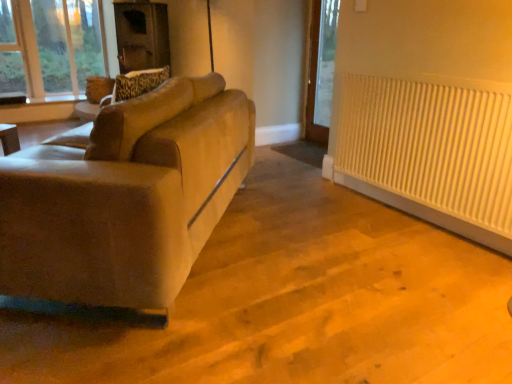
Question: Considering the relative sizes of white ribbed radiator at right and beige fabric swivel chair at left in the image provided, is white ribbed radiator at right smaller than beige fabric swivel chair at left?

Choices:
 (A) no
 (B) yes

Answer: (A)

Question: Does white ribbed radiator at right have a greater height compared to beige fabric swivel chair at left?

Choices:
 (A) yes
 (B) no

Answer: (A)

Question: Is the surface of white ribbed radiator at right in direct contact with beige fabric swivel chair at left?

Choices:
 (A) yes
 (B) no

Answer: (B)

Question: From a real-world perspective, is white ribbed radiator at right over beige fabric swivel chair at left?

Choices:
 (A) no
 (B) yes

Answer: (A)

Question: Is white ribbed radiator at right to the right of beige fabric swivel chair at left from the viewer's perspective?

Choices:
 (A) yes
 (B) no

Answer: (A)

Question: Is beige fabric swivel chair at left in front of or behind white ribbed radiator at right in the image?

Choices:
 (A) behind
 (B) front

Answer: (B)

Question: Considering the positions of beige fabric swivel chair at left and white ribbed radiator at right in the image, is beige fabric swivel chair at left wider or thinner than white ribbed radiator at right?

Choices:
 (A) wide
 (B) thin

Answer: (A)

Question: Do you think beige fabric swivel chair at left is within white ribbed radiator at right, or outside of it?

Choices:
 (A) inside
 (B) outside

Answer: (B)

Question: From the image's perspective, relative to white ribbed radiator at right, is beige fabric swivel chair at left above or below?

Choices:
 (A) below
 (B) above

Answer: (B)

Question: Would you say suede-like beige couch at left is to the left or to the right of beige fabric swivel chair at left in the picture?

Choices:
 (A) right
 (B) left

Answer: (B)

Question: Looking at their shapes, would you say suede-like beige couch at left is wider or thinner than beige fabric swivel chair at left?

Choices:
 (A) thin
 (B) wide

Answer: (B)

Question: In terms of size, does suede-like beige couch at left appear bigger or smaller than beige fabric swivel chair at left?

Choices:
 (A) big
 (B) small

Answer: (A)

Question: Is suede-like beige couch at left in front of or behind beige fabric swivel chair at left in the image?

Choices:
 (A) behind
 (B) front

Answer: (B)

Question: From a real-world perspective, is suede-like beige couch at left above or below white ribbed radiator at right?

Choices:
 (A) above
 (B) below

Answer: (A)

Question: Based on their positions, is suede-like beige couch at left located to the left or right of white ribbed radiator at right?

Choices:
 (A) left
 (B) right

Answer: (A)